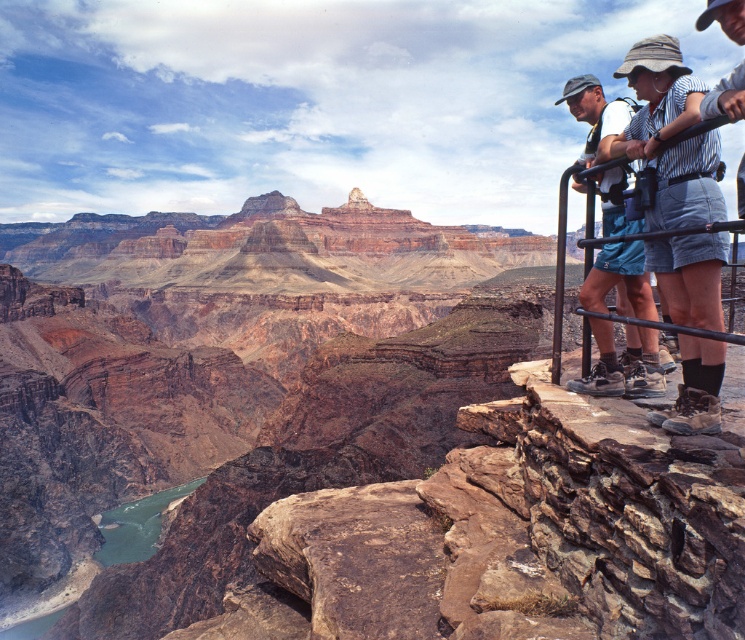
You are a photographer planning to take a photo of the rustic rock canyon at upper center and the matte blue shorts at right. Based on the scene, which object is located to the right of the other?

The rustic rock canyon at upper center is positioned on the right side of matte blue shorts at right.

You are a photographer planning to capture a photo of the rustic rock canyon at upper center and the matte blue shorts at right. Based on their positions, which object should be placed in the foreground of your composition?

The matte blue shorts at right should be placed in the foreground because the rustic rock canyon at upper center is located below it, meaning the shorts are closer to the viewer.